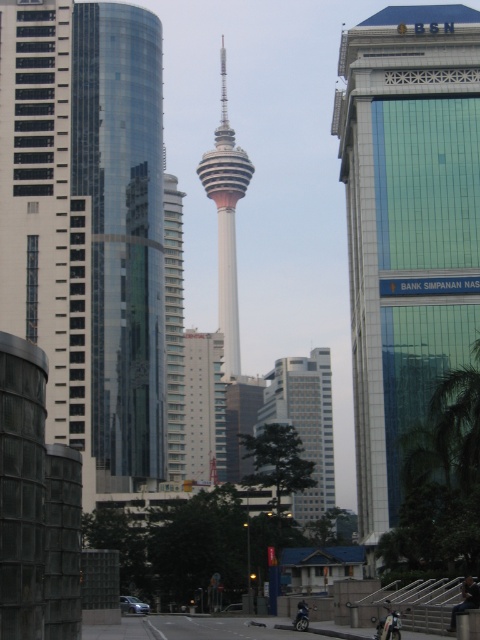
You are standing at the point closest to the viewer in this urban scene. Which point are you at, point [173,296] or point [303,621]?

You are at point [173,296] because it is further to the viewer than point [303,621].

You are standing at the base of the Kuala Lumpur Tower and want to reach the point marked at coordinates point (x=448, y=173). Given that the tower is 421 meters tall, can you estimate whether the point is above or below the tower?

The point is below the tower since the distance from the viewer to the point is 133.87 meters, which is less than the tower height of 421 meters.